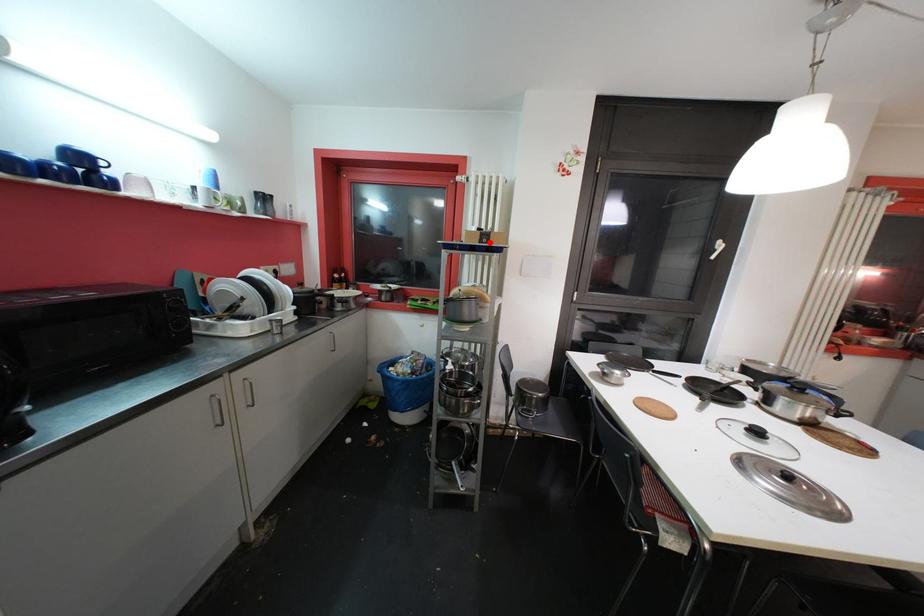
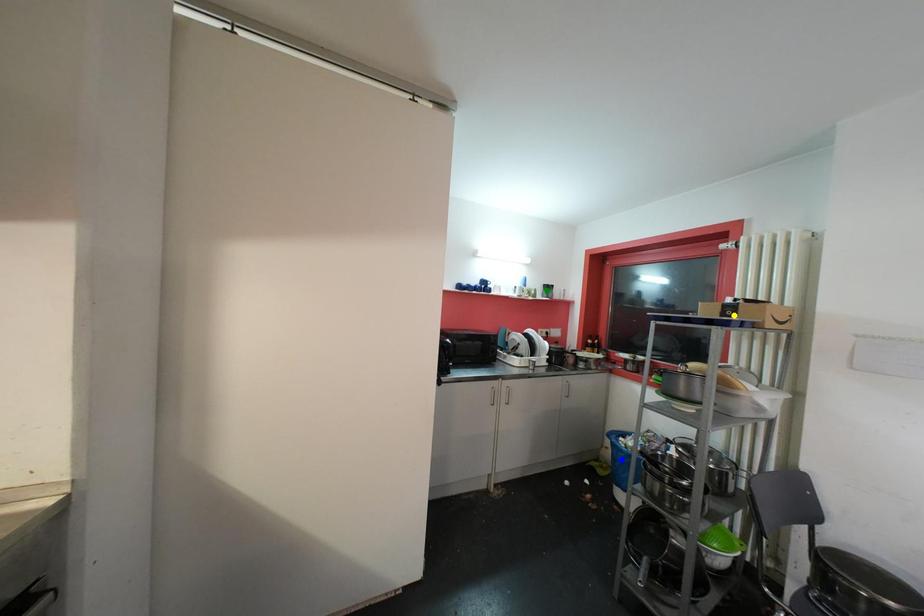
Question: I am providing you with two images of the same scene from different viewpoints. A red point is marked on the first image. You are given multiple points on the second image. In image 2, which mark is for the same physical point as the one in image 1?

Choices:
 (A) yellow point
 (B) blue point
 (C) green point

Answer: (A)